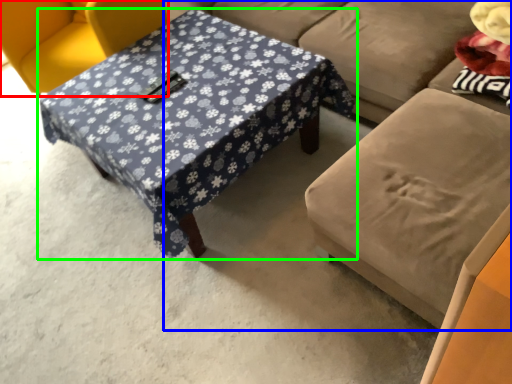
Question: Based on their relative distances, which object is nearer to chair (highlighted by a red box)? Choose from studio couch (highlighted by a blue box) and table (highlighted by a green box).

Choices:
 (A) studio couch
 (B) table

Answer: (B)